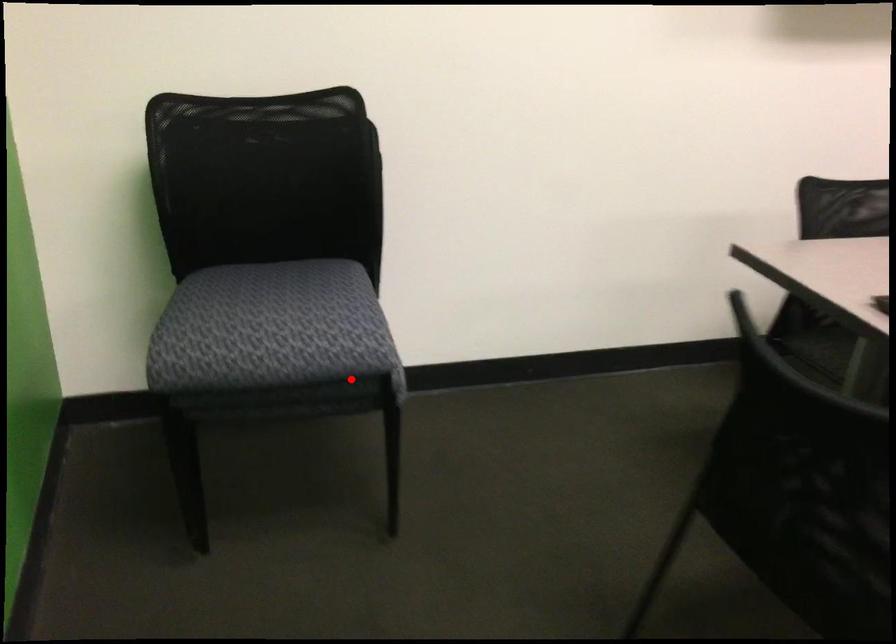
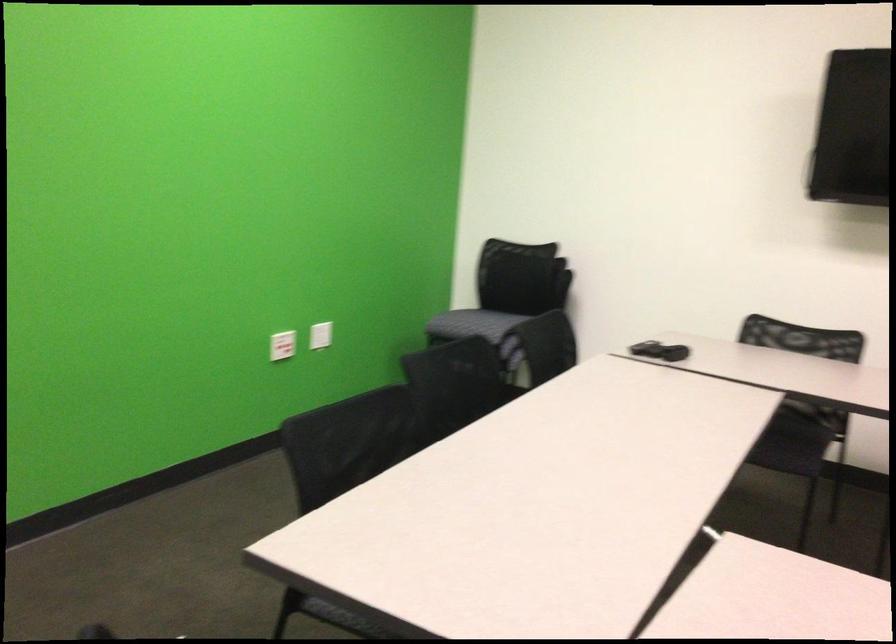
Question: I am providing you with two images of the same scene from different viewpoints. A red point is shown in image1. For the corresponding object point in image2, is it positioned nearer or farther from the camera?

Choices:
 (A) Nearer
 (B) Farther

Answer: (B)